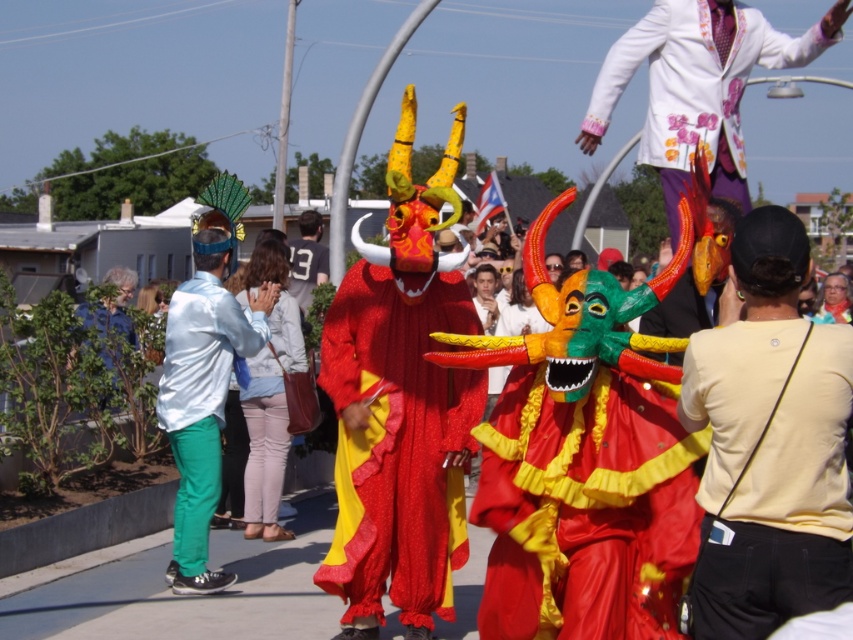
You are standing at the point marked as point [352,266] in the image. The nearest mythical creature costume is 5 meters away from you. Can you reach it without moving more than 10 meters?

The distance of point [352,266] from viewer is 10.19 meters. Since the nearest mythical creature costume is only 5 meters away from you, you can easily reach it by moving forward 5 meters without exceeding the 10 meters limit.